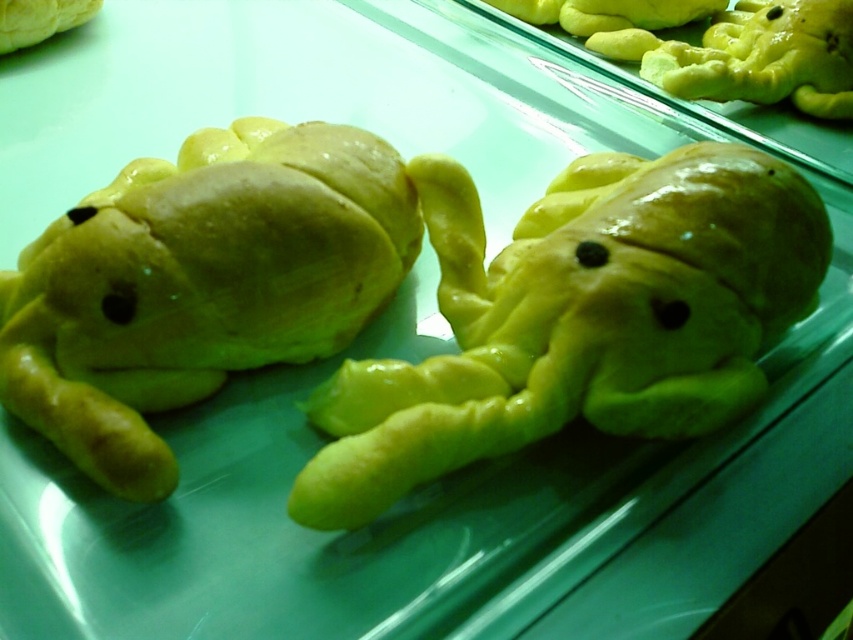
Question: Can you confirm if yellow matte dough at center is wider than yellow matte frog at left?

Choices:
 (A) no
 (B) yes

Answer: (B)

Question: Which of the following is the closest to the observer?

Choices:
 (A) (151, 355)
 (B) (503, 259)

Answer: (A)

Question: Is yellow matte dough at center below yellow matte frog at left?

Choices:
 (A) yes
 (B) no

Answer: (A)

Question: Does yellow matte dough at center appear on the right side of yellow matte frog at left?

Choices:
 (A) no
 (B) yes

Answer: (B)

Question: Which point appears closest to the camera in this image?

Choices:
 (A) (39, 328)
 (B) (570, 198)

Answer: (A)